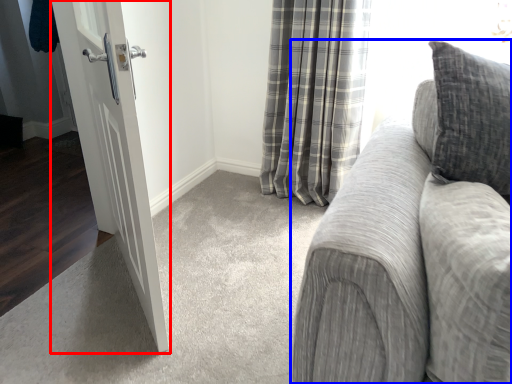
Question: Which of the following is the closest to the observer, door (highlighted by a red box) or studio couch (highlighted by a blue box)?

Choices:
 (A) door
 (B) studio couch

Answer: (B)